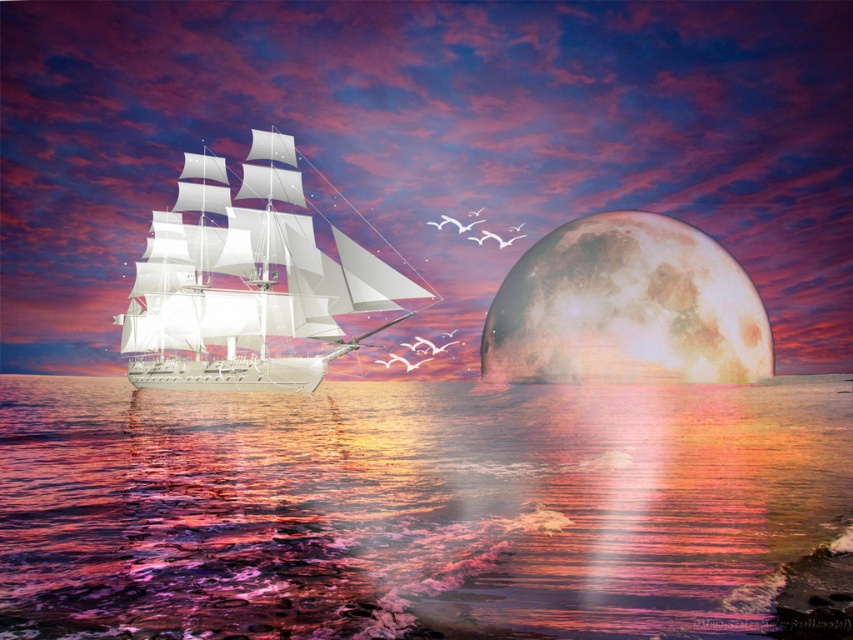
You are an astronaut floating in space and see the image. You need to determine which object is wider between the shiny metallic water at lower center and the rustic textured moon at right. Which one is wider?

The shiny metallic water at lower center is wider than the rustic textured moon at right according to the description.

Looking at this image, you are an observer standing on the deck of the white glossy sailboat at left. Looking towards the rustic textured moon at right, which direction should you face to see it?

Since the white glossy sailboat at left is positioned on the left side of rustic textured moon at right, you should face towards the right direction to see the rustic textured moon at right from the white glossy sailboat at left.